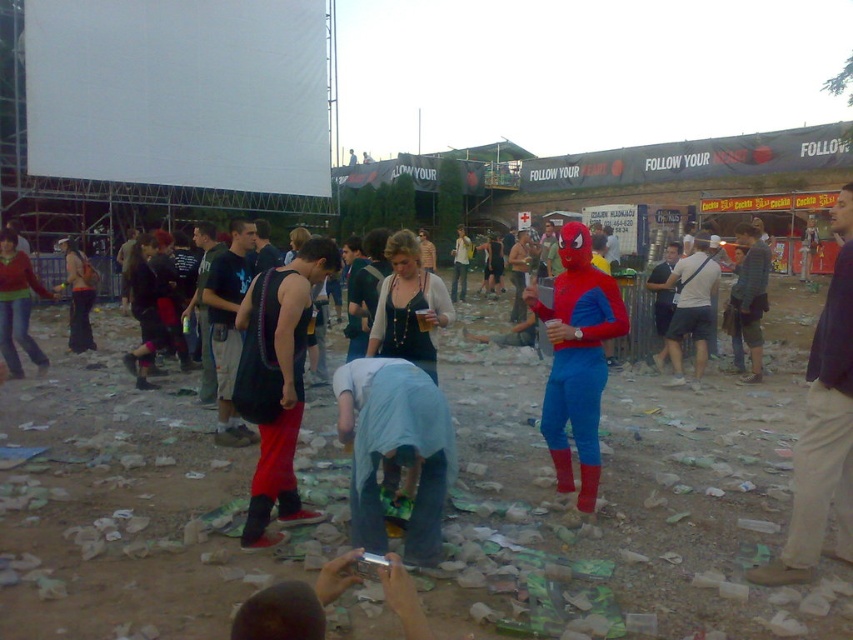
Question: Is blue spandex suit at center behind matte black hoodie at left?

Choices:
 (A) no
 (B) yes

Answer: (B)

Question: Which of these objects is positioned closest to the shiny blue spandex suit at center?

Choices:
 (A) blue spandex suit at center
 (B) denim shorts at center

Answer: (A)

Question: Which object is the closest to the denim shorts at center?

Choices:
 (A) shiny blue spandex suit at center
 (B) denim jeans at center
 (C) blue spandex suit at center
 (D) matte black tank top at center

Answer: (C)

Question: Can you confirm if matte black tank top at center is positioned above denim shorts at center?

Choices:
 (A) yes
 (B) no

Answer: (B)

Question: Is light brown leather pants at lower right to the left of matte black hoodie at left from the viewer's perspective?

Choices:
 (A) no
 (B) yes

Answer: (A)

Question: Considering the real-world distances, which object is farthest from the blue spandex suit at center?

Choices:
 (A) matte black hoodie at left
 (B) shiny blue spandex suit at center

Answer: (A)